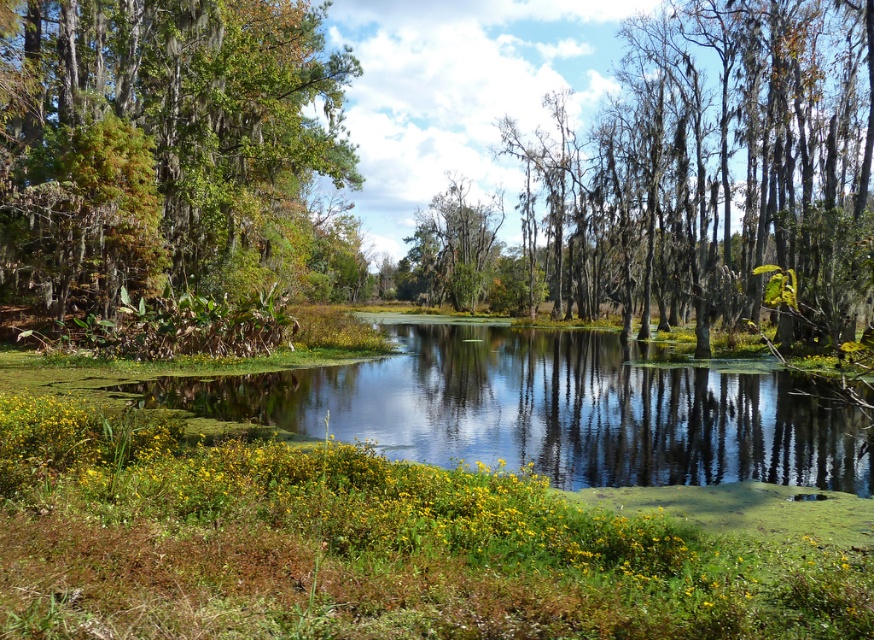
Is gray mossy trees at center smaller than green mossy tree at upper left?

No, gray mossy trees at center is not smaller than green mossy tree at upper left.

How far apart are gray mossy trees at center and green mossy tree at upper left?

They are 23.25 meters apart.

Is point (653, 227) farther from viewer compared to point (261, 88)?

Yes.

At what (x,y) coordinates should I click in order to perform the action: click on gray mossy trees at center. Please return your answer as a coordinate pair (x, y). This screenshot has width=874, height=640. Looking at the image, I should click on (713, 172).

Between green mossy tree at upper left and green mossy tree at center, which one appears on the right side from the viewer's perspective?

Positioned to the right is green mossy tree at center.

Is point (50, 49) behind point (415, 221)?

No.

Is point (116, 140) positioned after point (455, 264)?

That is False.

Identify the location of green mossy tree at upper left. This screenshot has height=640, width=874. (161, 145).

Is gray mossy trees at center bigger than green mossy tree at center?

Correct, gray mossy trees at center is larger in size than green mossy tree at center.

This screenshot has height=640, width=874. What do you see at coordinates (713, 172) in the screenshot? I see `gray mossy trees at center` at bounding box center [713, 172].

Image resolution: width=874 pixels, height=640 pixels. In order to click on gray mossy trees at center in this screenshot , I will do `click(713, 172)`.